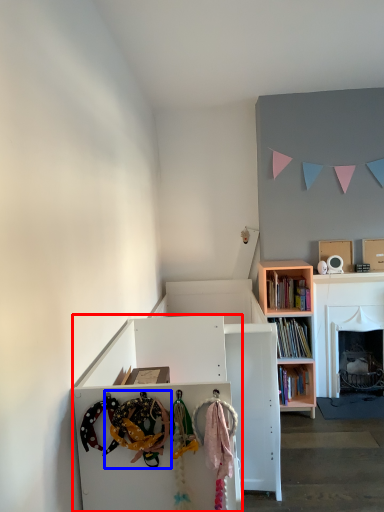
Question: Which object appears closest to the camera in this image, cabinetry (highlighted by a red box) or toy (highlighted by a blue box)?

Choices:
 (A) cabinetry
 (B) toy

Answer: (B)